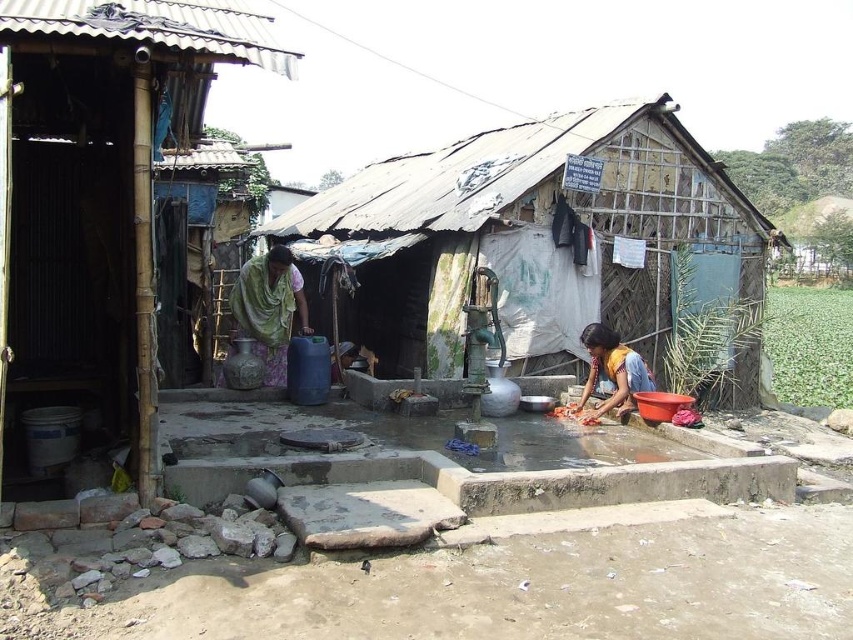
Question: Which of these objects is positioned farthest from the yellow fabric dress at lower right?

Choices:
 (A) rustic bamboo hut at left
 (B) rusty corrugated metal hut at center

Answer: (A)

Question: Which object is positioned farthest from the green fabric shawl at center?

Choices:
 (A) yellow fabric dress at lower right
 (B) rusty corrugated metal hut at center

Answer: (B)

Question: Does rustic bamboo hut at left appear over green fabric shawl at center?

Choices:
 (A) yes
 (B) no

Answer: (A)

Question: Considering the relative positions of rusty corrugated metal hut at center and green fabric shawl at center in the image provided, where is rusty corrugated metal hut at center located with respect to green fabric shawl at center?

Choices:
 (A) above
 (B) below

Answer: (A)

Question: Can you confirm if rusty corrugated metal hut at center is bigger than rustic bamboo hut at left?

Choices:
 (A) no
 (B) yes

Answer: (B)

Question: Which point is farther to the camera?

Choices:
 (A) rusty corrugated metal hut at center
 (B) rustic bamboo hut at left
 (C) green fabric shawl at center

Answer: (A)